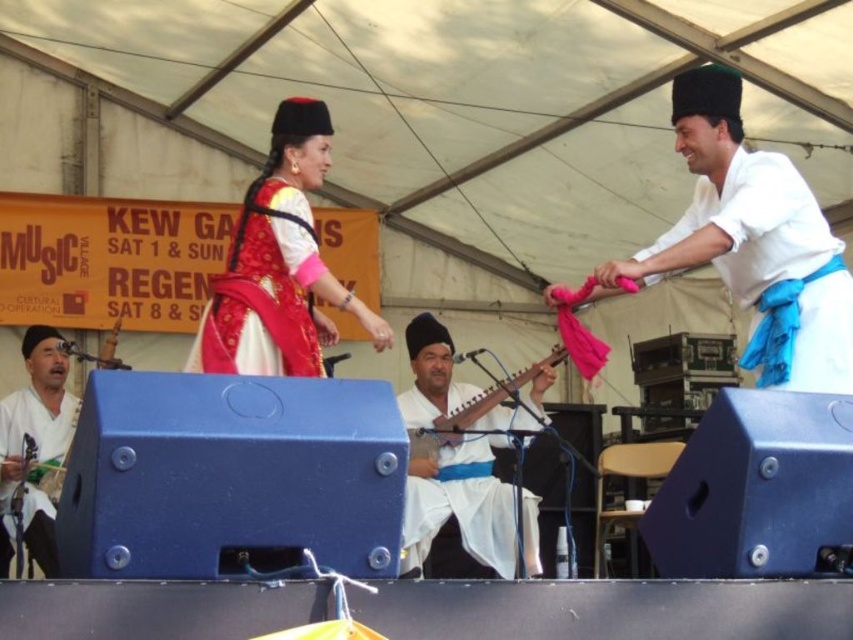
Who is more distant from viewer, (830, 353) or (276, 300)?

The point (276, 300) is behind.

Who is lower down, white cotton shirt at upper right or matte red fabric dress at center?

Positioned lower is white cotton shirt at upper right.

Which is in front, point (790, 186) or point (276, 353)?

Point (790, 186) is in front.

You are a GUI agent. You are given a task and a screenshot of the screen. Output one action in this format:
    pyautogui.click(x=<x>, y=<y>)
    Task: Click on the white cotton shirt at upper right
    
    Given the screenshot: What is the action you would take?
    pyautogui.click(x=775, y=269)

In the scene shown: Can you confirm if white cotton shirt at upper right is shorter than matte white shirt at lower left?

Correct, white cotton shirt at upper right is not as tall as matte white shirt at lower left.

Is point (763, 339) more distant than point (15, 492)?

No, it is not.

The image size is (853, 640). I want to click on white cotton shirt at upper right, so click(x=775, y=269).

Is white satin/silk guitar at center above matte white shirt at lower left?

Yes, white satin/silk guitar at center is above matte white shirt at lower left.

Who is higher up, white satin/silk guitar at center or matte white shirt at lower left?

Positioned higher is white satin/silk guitar at center.

Who is more distant from viewer, [518,419] or [56,412]?

The point [56,412] is behind.

Where is `white satin/silk guitar at center`? This screenshot has width=853, height=640. white satin/silk guitar at center is located at coordinates (461, 504).